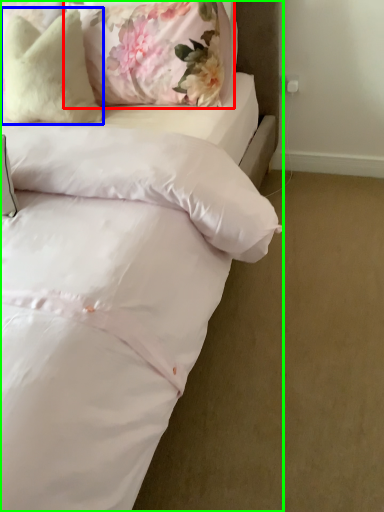
Question: Based on their relative distances, which object is farther from pillow (highlighted by a red box)? Choose from pillow (highlighted by a blue box) and bed (highlighted by a green box).

Choices:
 (A) pillow
 (B) bed

Answer: (B)